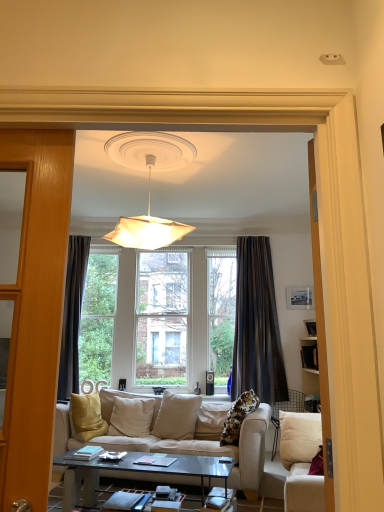
Image resolution: width=384 pixels, height=512 pixels. I want to click on dark gray textured curtain at center, so click(257, 325).

The image size is (384, 512). Identify the location of matte black picture frame at upper right. (299, 297).

The width and height of the screenshot is (384, 512). What do you see at coordinates (299, 297) in the screenshot?
I see `matte black picture frame at upper right` at bounding box center [299, 297].

Where is `white fabric studio couch at lower right, marked as the 1th studio couch in a front-to-back arrangement`? This screenshot has width=384, height=512. white fabric studio couch at lower right, marked as the 1th studio couch in a front-to-back arrangement is located at coordinates (297, 464).

Is white fabric studio couch at lower right, marked as the 1th studio couch in a front-to-back arrangement, aimed at glassy black coffee table at center?

Yes.

Does white fabric studio couch at lower right, the second studio couch when ordered from back to front, touch glassy black coffee table at center?

No, white fabric studio couch at lower right, the second studio couch when ordered from back to front, is not in contact with glassy black coffee table at center.

Can you confirm if white fabric studio couch at lower right, the second studio couch when ordered from back to front, is shorter than glassy black coffee table at center?

No, white fabric studio couch at lower right, the second studio couch when ordered from back to front, is not shorter than glassy black coffee table at center.

Is white fabric studio couch at lower right, marked as the 1th studio couch in a front-to-back arrangement, completely or partially inside beige fabric couch at center, placed as the 2th studio couch when sorted from front to back?

Actually, white fabric studio couch at lower right, marked as the 1th studio couch in a front-to-back arrangement, is outside beige fabric couch at center, placed as the 2th studio couch when sorted from front to back.

Is beige fabric couch at center, placed as the 2th studio couch when sorted from front to back, positioned far away from white fabric studio couch at lower right, the second studio couch when ordered from back to front?

No.

Is beige fabric couch at center, which is the 1th studio couch in back-to-front order, further to the viewer compared to white fabric studio couch at lower right, marked as the 1th studio couch in a front-to-back arrangement?

Yes, it is behind white fabric studio couch at lower right, marked as the 1th studio couch in a front-to-back arrangement.

Image resolution: width=384 pixels, height=512 pixels. I want to click on studio couch behind the white fabric studio couch at lower right, marked as the 1th studio couch in a front-to-back arrangement, so click(208, 448).

Is white paper lampshade at upper center wider or thinner than glassy black coffee table at center?

In the image, white paper lampshade at upper center appears to be wider than glassy black coffee table at center.

Could you tell me if white paper lampshade at upper center is facing glassy black coffee table at center?

No, white paper lampshade at upper center is not turned towards glassy black coffee table at center.

Is point (138, 238) behind point (183, 474)?

Yes, point (138, 238) is farther from viewer.

From the picture: Can you confirm if matte black picture frame at upper right is positioned to the left of dark gray textured curtain at center?

In fact, matte black picture frame at upper right is to the right of dark gray textured curtain at center.

Looking at this image, from the image's perspective, between matte black picture frame at upper right and dark gray textured curtain at center, which one is located above?

matte black picture frame at upper right.

Is matte black picture frame at upper right inside the boundaries of dark gray textured curtain at center, or outside?

matte black picture frame at upper right lies outside dark gray textured curtain at center.

Considering the points (296, 298) and (249, 244), which point is behind, point (296, 298) or point (249, 244)?

The point (249, 244) is farther.

Are white paper lampshade at upper center and matte black picture frame at upper right located far from each other?

Yes.

From a real-world perspective, which is physically below, white paper lampshade at upper center or matte black picture frame at upper right?

matte black picture frame at upper right.

Which object is positioned more to the left, white paper lampshade at upper center or matte black picture frame at upper right?

white paper lampshade at upper center.

How distant is white paper lampshade at upper center from matte black picture frame at upper right?

white paper lampshade at upper center is 9.74 feet away from matte black picture frame at upper right.

From the image's perspective, which object appears higher, dark gray textured curtain at center or matte black picture frame at upper right?

matte black picture frame at upper right appears higher in the image.

Would you say dark gray textured curtain at center is outside matte black picture frame at upper right?

Indeed, dark gray textured curtain at center is completely outside matte black picture frame at upper right.

Which object is further away from the camera, dark gray textured curtain at center or matte black picture frame at upper right?

matte black picture frame at upper right is further from the camera.

Does dark gray textured curtain at center turn towards matte black picture frame at upper right?

No.

From the image's perspective, which is above, dark gray textured curtain at center or beige fabric couch at center, which is the 1th studio couch in back-to-front order?

dark gray textured curtain at center, from the image's perspective.

Between dark gray textured curtain at center and beige fabric couch at center, placed as the 2th studio couch when sorted from front to back, which one has larger size?

Bigger between the two is beige fabric couch at center, placed as the 2th studio couch when sorted from front to back.

From a real-world perspective, which object rests below the other?

beige fabric couch at center, placed as the 2th studio couch when sorted from front to back, from a real-world perspective.

Considering the sizes of dark gray textured curtain at center and beige fabric couch at center, which is the 1th studio couch in back-to-front order, in the image, is dark gray textured curtain at center taller or shorter than beige fabric couch at center, which is the 1th studio couch in back-to-front order,?

dark gray textured curtain at center is taller than beige fabric couch at center, which is the 1th studio couch in back-to-front order.

Identify the location of coffee table beneath the white fabric studio couch at lower right, marked as the 1th studio couch in a front-to-back arrangement (from a real-world perspective). (133, 471).

Where is `studio couch below the white fabric studio couch at lower right, marked as the 1th studio couch in a front-to-back arrangement (from the image's perspective)`? The width and height of the screenshot is (384, 512). studio couch below the white fabric studio couch at lower right, marked as the 1th studio couch in a front-to-back arrangement (from the image's perspective) is located at coordinates (208, 448).

From the image, which object appears to be nearer to white fabric studio couch at lower right, marked as the 1th studio couch in a front-to-back arrangement, beige fabric couch at center, placed as the 2th studio couch when sorted from front to back, or white paper lampshade at upper center?

beige fabric couch at center, placed as the 2th studio couch when sorted from front to back, lies closer to white fabric studio couch at lower right, marked as the 1th studio couch in a front-to-back arrangement, than the other object.

Consider the image. Estimate the real-world distances between objects in this image. Which object is further from glassy black coffee table at center, white fabric studio couch at lower right, the second studio couch when ordered from back to front, or dark gray textured curtain at center?

dark gray textured curtain at center is further to glassy black coffee table at center.

Estimate the real-world distances between objects in this image. Which object is closer to matte black picture frame at upper right, beige fabric couch at center, placed as the 2th studio couch when sorted from front to back, or white paper lampshade at upper center?

beige fabric couch at center, placed as the 2th studio couch when sorted from front to back, is positioned closer to the anchor matte black picture frame at upper right.

Looking at the image, which one is located further to beige fabric couch at center, which is the 1th studio couch in back-to-front order, dark gray textured curtain at center or matte black picture frame at upper right?

The object further to beige fabric couch at center, which is the 1th studio couch in back-to-front order, is matte black picture frame at upper right.

From the image, which object appears to be farther from beige fabric couch at center, placed as the 2th studio couch when sorted from front to back, matte black picture frame at upper right or white paper lampshade at upper center?

The object further to beige fabric couch at center, placed as the 2th studio couch when sorted from front to back, is matte black picture frame at upper right.

Based on their spatial positions, is matte black picture frame at upper right or beige fabric couch at center, which is the 1th studio couch in back-to-front order, closer to white paper lampshade at upper center?

Based on the image, beige fabric couch at center, which is the 1th studio couch in back-to-front order, appears to be nearer to white paper lampshade at upper center.

Based on their spatial positions, is matte black picture frame at upper right or white fabric studio couch at lower right, marked as the 1th studio couch in a front-to-back arrangement, further from white paper lampshade at upper center?

Among the two, matte black picture frame at upper right is located further to white paper lampshade at upper center.

When comparing their distances from glassy black coffee table at center, does dark gray textured curtain at center or beige fabric couch at center, which is the 1th studio couch in back-to-front order, seem closer?

beige fabric couch at center, which is the 1th studio couch in back-to-front order, is positioned closer to the anchor glassy black coffee table at center.

You are a GUI agent. You are given a task and a screenshot of the screen. Output one action in this format:
    pyautogui.click(x=<x>, y=<y>)
    Task: Click on the studio couch between white paper lampshade at upper center and beige fabric couch at center, which is the 1th studio couch in back-to-front order, from top to bottom
    The image size is (384, 512).
    Given the screenshot: What is the action you would take?
    pyautogui.click(x=297, y=464)

Locate an element on the screen. lamp between white fabric studio couch at lower right, marked as the 1th studio couch in a front-to-back arrangement, and dark gray textured curtain at center, along the z-axis is located at coordinates (147, 226).

The width and height of the screenshot is (384, 512). Find the location of `curtain between beige fabric couch at center, which is the 1th studio couch in back-to-front order, and matte black picture frame at upper right in the front-back direction`. curtain between beige fabric couch at center, which is the 1th studio couch in back-to-front order, and matte black picture frame at upper right in the front-back direction is located at coordinates (257, 325).

Locate an element on the screen. curtain between white fabric studio couch at lower right, marked as the 1th studio couch in a front-to-back arrangement, and matte black picture frame at upper right, along the z-axis is located at coordinates (257, 325).